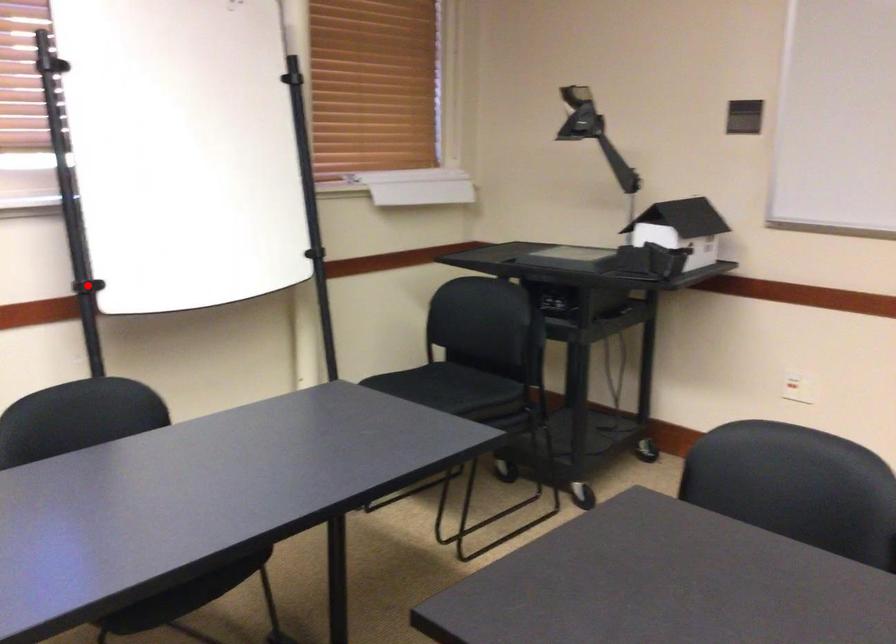
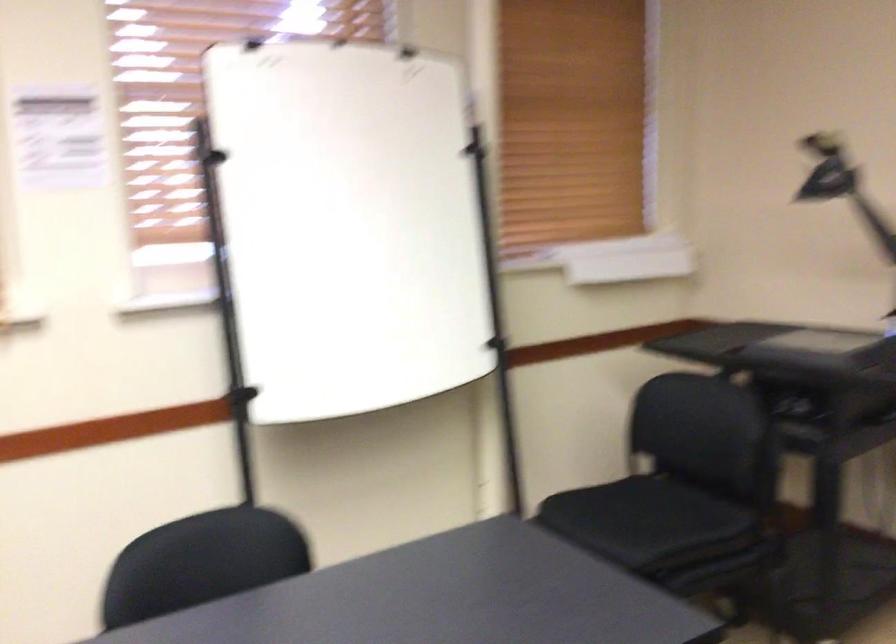
Question: I am providing you with two images of the same scene from different viewpoints. A red point is marked on the first image. At the location where the point appears in image 1, is it still visible in image 2?

Choices:
 (A) Yes
 (B) No

Answer: (B)